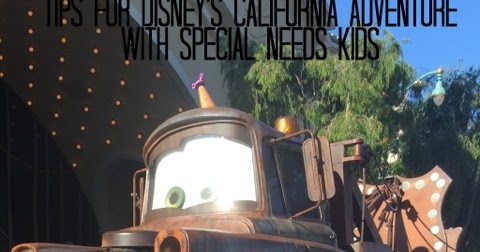
At what (x,y) coordinates should I click in order to perform the action: click on arch. Please return your answer as a coordinate pair (x, y). Looking at the image, I should click on (142, 82).